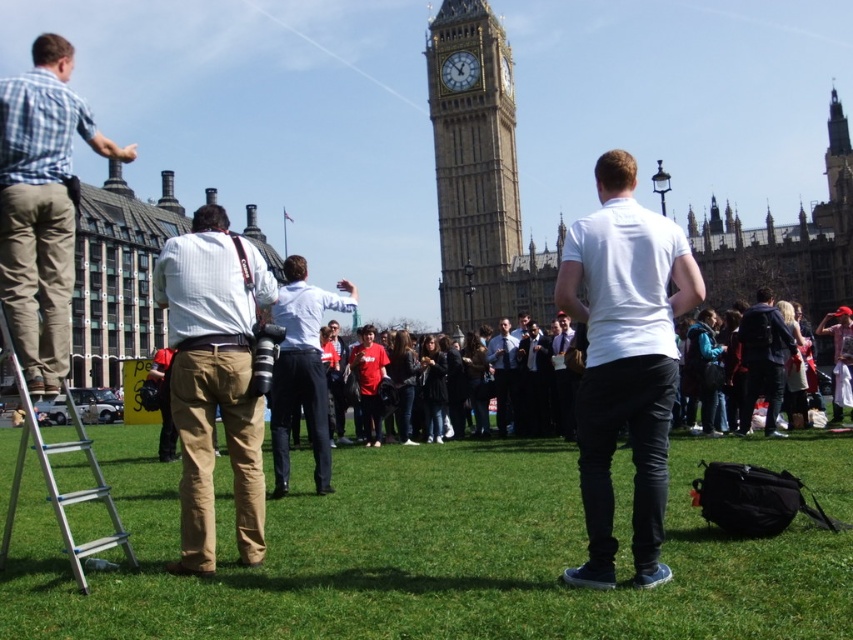
Does khaki cotton pants at center appear under stone clock tower at center?

Correct, khaki cotton pants at center is located below stone clock tower at center.

Which is in front, point (199, 512) or point (509, 108)?

Point (199, 512) is more forward.

Where is `khaki cotton pants at center`? khaki cotton pants at center is located at coordinates (213, 378).

Between point (32, 141) and point (762, 308), which one is positioned behind?

The point (762, 308) is more distant.

What do you see at coordinates (42, 208) in the screenshot? The height and width of the screenshot is (640, 853). I see `plaid shirt at left` at bounding box center [42, 208].

Which is behind, point (41, 266) or point (753, 372)?

Point (753, 372)

Where is `plaid shirt at left`? The image size is (853, 640). plaid shirt at left is located at coordinates (42, 208).

Is white matte shirt at center smaller than light blue shirt at center?

Yes, white matte shirt at center is smaller than light blue shirt at center.

Is point (602, 552) farther from viewer compared to point (276, 310)?

No.

Who is more distant from viewer, (657, 272) or (280, 346)?

The point (280, 346) is more distant.

Locate an element on the screen. white matte shirt at center is located at coordinates (624, 362).